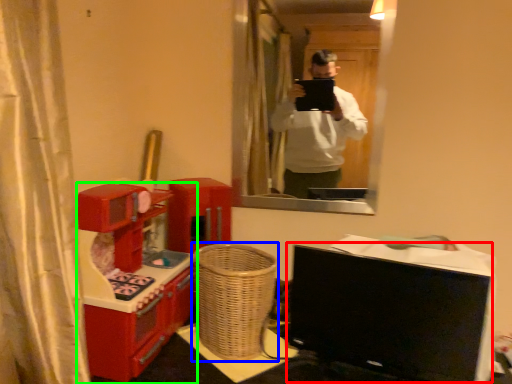
Question: Based on their relative distances, which object is farther from computer monitor (highlighted by a red box)? Choose from basket (highlighted by a blue box) and furniture (highlighted by a green box).

Choices:
 (A) basket
 (B) furniture

Answer: (B)